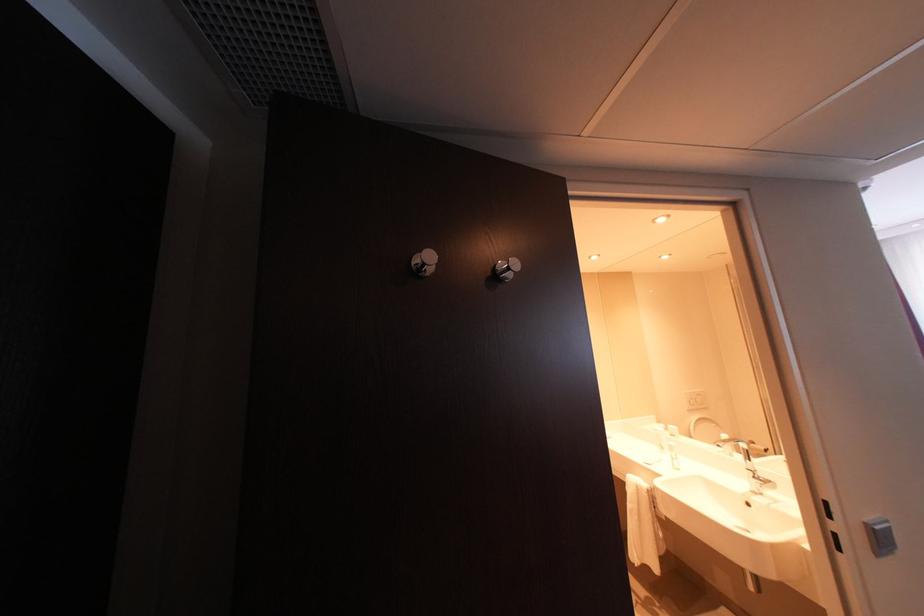
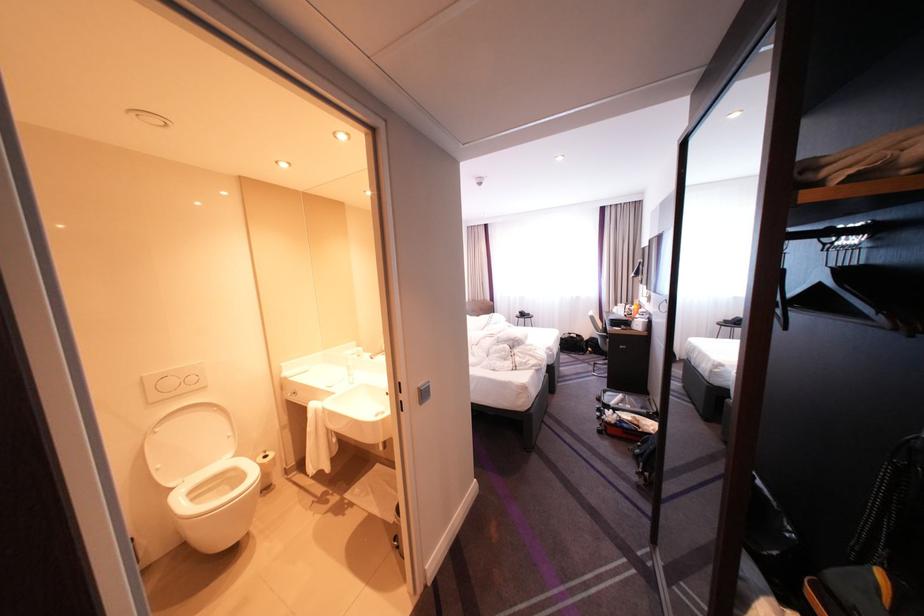
The point at (878, 525) is marked in the first image. Where is the corresponding point in the second image?

(430, 389)